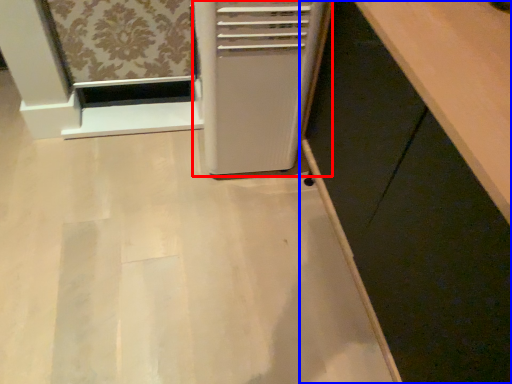
Question: Which object appears closest to the camera in this image, home appliance (highlighted by a red box) or cabinetry (highlighted by a blue box)?

Choices:
 (A) home appliance
 (B) cabinetry

Answer: (B)